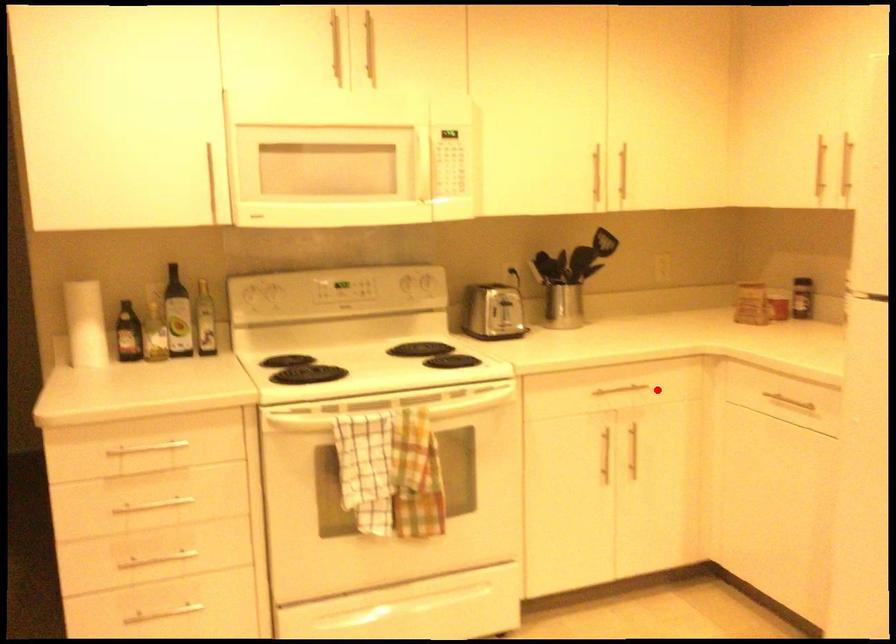
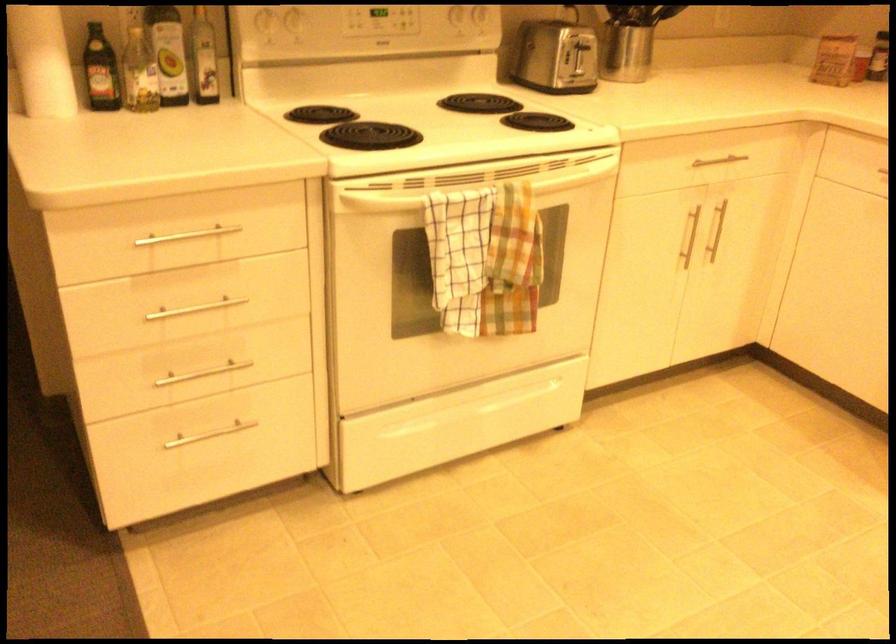
Find the pixel in the second image that matches the highlighted location in the first image.

(745, 164)